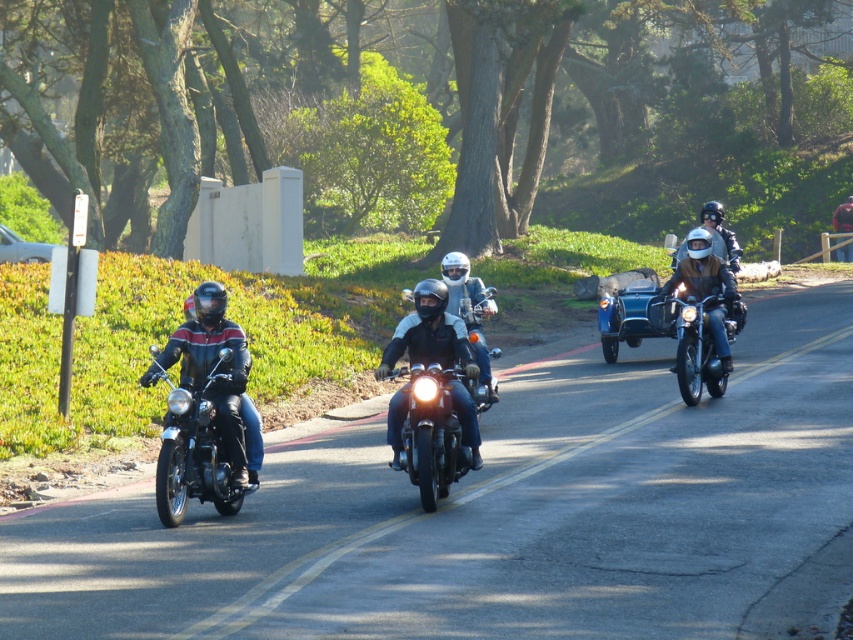
Looking at this image, between shiny black motorcycle at left and shiny chrome motorcycle at center, which one has more height?

With more height is shiny black motorcycle at left.

At what (x,y) coordinates should I click in order to perform the action: click on shiny black motorcycle at left. Please return your answer as a coordinate pair (x, y). Looking at the image, I should click on (193, 445).

Can you confirm if shiny chrome motorcycle at right is bigger than matte black motorcycle at right?

No.

This screenshot has height=640, width=853. Describe the element at coordinates (695, 346) in the screenshot. I see `shiny chrome motorcycle at right` at that location.

Where is `shiny chrome motorcycle at right`? The height and width of the screenshot is (640, 853). shiny chrome motorcycle at right is located at coordinates (695, 346).

Which is in front, point (158, 481) or point (703, 256)?

Point (158, 481) is more forward.

Is point (202, 438) behind point (717, 308)?

No.

Identify the location of shiny black motorcycle at left. The image size is (853, 640). (193, 445).